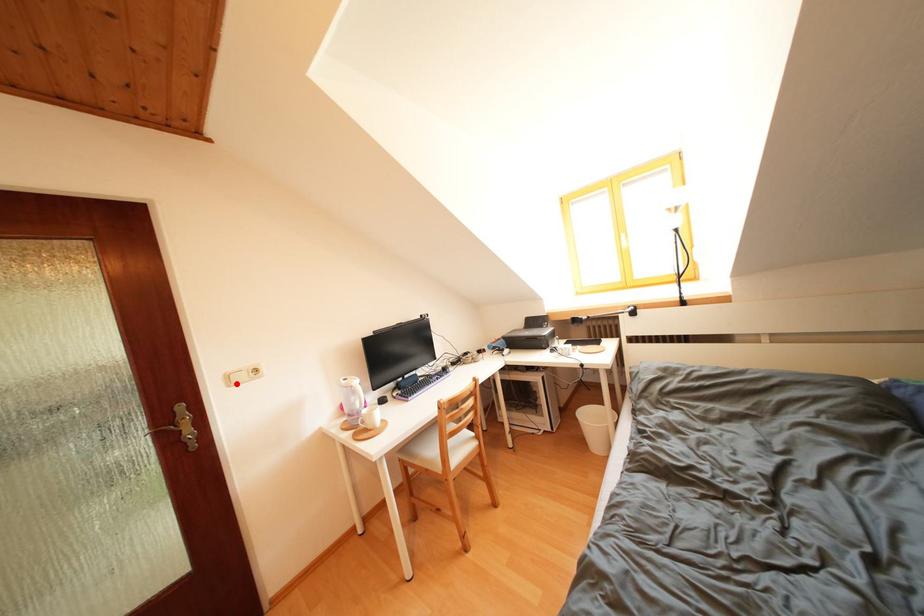
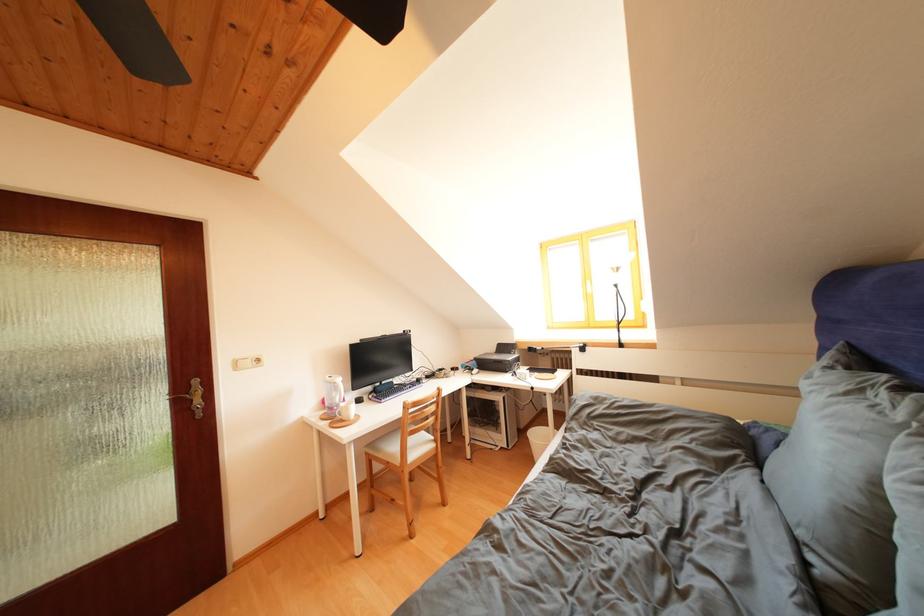
The point at the highlighted location is marked in the first image. Where is the corresponding point in the second image?

(244, 369)